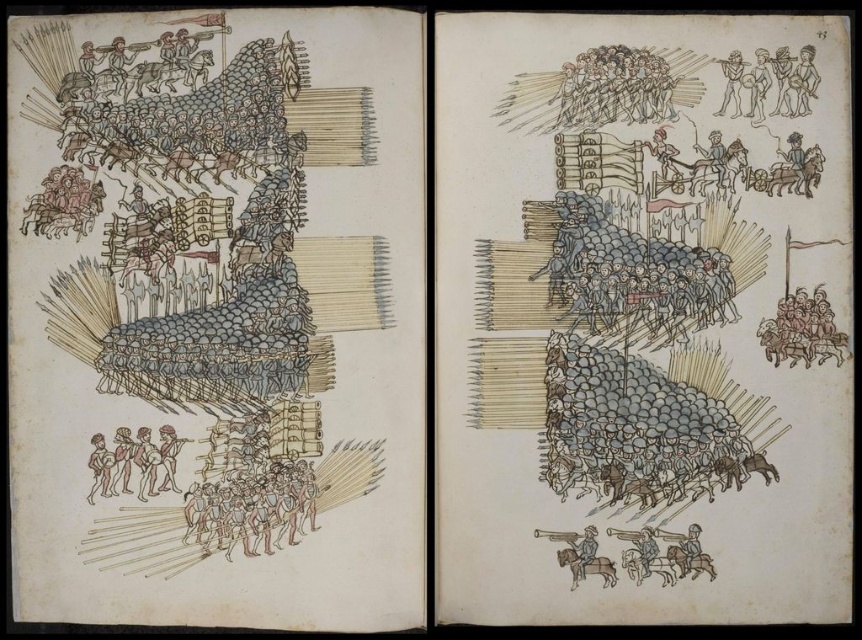
You are a soldier positioned at point (728,56). You need to move to point (648,548). Based on the battle formation depicted in the manual, will you be moving towards the front or the rear of the formation?

Point (728,56) is behind point (648,548). Therefore, moving from point (728,56) to point (648,548) means you are moving towards the front of the formation.

You are a medieval knight examining the battle formation in the manual. You notice the brown wood soldiers at upper center and the brown leather armor at lower right. Based on their positions in the illustration, which object is positioned higher up?

The brown wood soldiers at upper center are positioned higher up than the brown leather armor at lower right.

You are a medieval scribe examining the battle formation depicted in the manual. You notice the wooden flute at upper right and the brown leather horse at lower right. According to the illustration, which object is positioned to the right of the other?

The wooden flute at upper right is positioned to the right of the brown leather horse at lower right.